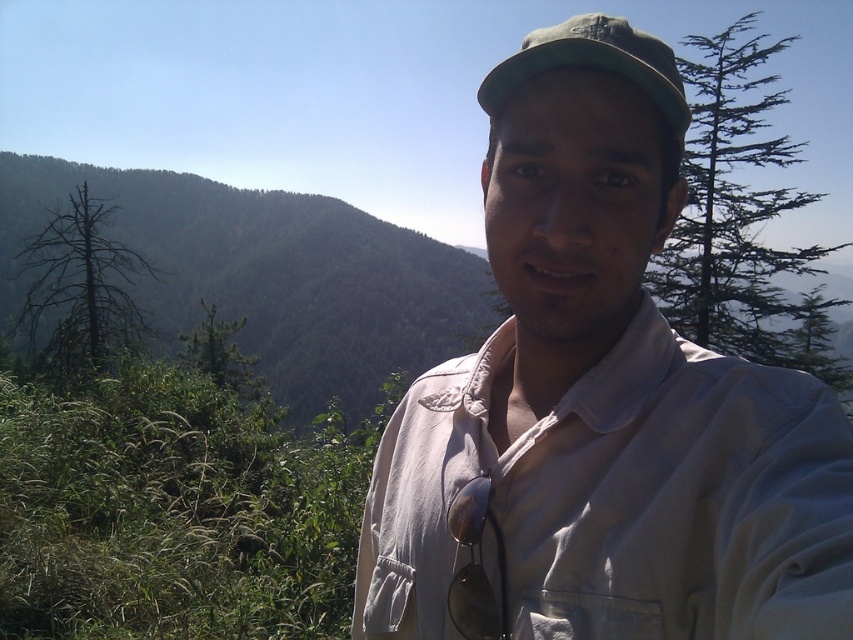
You are a photographer trying to capture a photo of the white cotton shirt at center and the green coniferous tree at upper right. If you want both subjects to be in focus, which one should you focus on first?

You should focus on the white cotton shirt at center first because it is closer to you than the green coniferous tree at upper right, which is farther away. This ensures the shirt is in focus while the tree may still be sharp due to depth of field.

You are a photographer trying to capture the perfect shot of the person in the mountainous region. You notice two points marked on your camera screen at coordinates point (495, 280) and point (97, 280). Which point is closer to you, the photographer?

Point (495, 280) is closer to the viewer than point (97, 280).

You are a photographer trying to capture a portrait of the person in the scene. You notice the dead brown tree at left and the green fabric cap at upper center are both in your frame. Which object is taller and might block the view of the person if not adjusted?

The dead brown tree at left is taller than the green fabric cap at upper center, so it might block the view of the person if not adjusted.